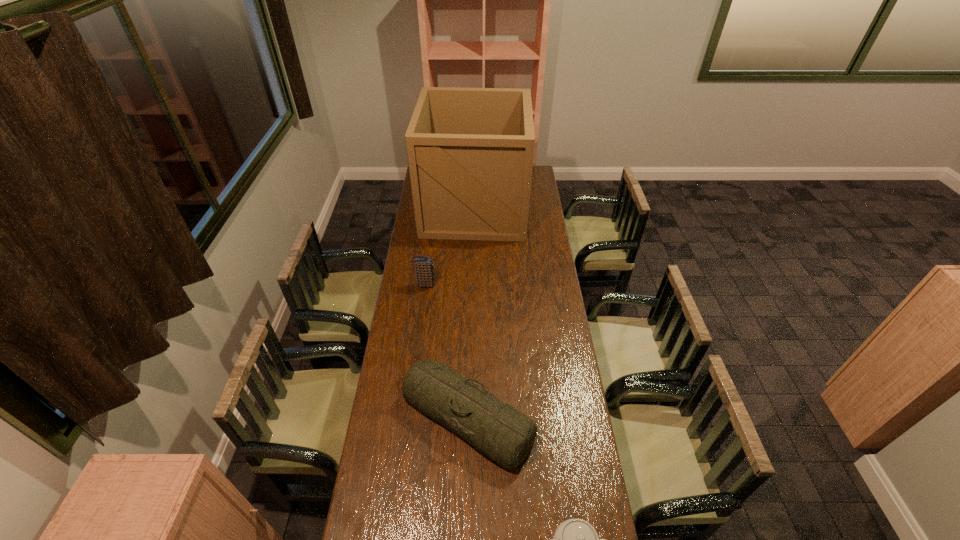
The height and width of the screenshot is (540, 960). What are the coordinates of `duffel bag positioned at the left edge` in the screenshot? It's located at (498, 430).

This screenshot has height=540, width=960. Find the location of `object at the right edge`. object at the right edge is located at coordinates (470, 151).

I want to click on object located at the far left corner, so click(470, 151).

Find the location of a particular element. This screenshot has height=540, width=960. object situated at the far right corner is located at coordinates (470, 151).

Find the location of a particular element. The height and width of the screenshot is (540, 960). vacant space at the left edge is located at coordinates (408, 494).

This screenshot has height=540, width=960. In order to click on vacant space at the right edge in this screenshot , I will do `click(540, 430)`.

This screenshot has height=540, width=960. In order to click on free spot between the tallest object and the clutch bag in this screenshot , I will do `click(449, 246)`.

Where is `empty space between the second nearest object and the clutch bag`? The image size is (960, 540). empty space between the second nearest object and the clutch bag is located at coordinates (446, 351).

This screenshot has height=540, width=960. I want to click on free point between the third farthest object and the clutch bag, so click(x=446, y=351).

Select which object appears as the third closest to the box. Please provide its 2D coordinates. Your answer should be formatted as a tuple, i.e. [(x, y)], where the tuple contains the x and y coordinates of a point satisfying the conditions above.

[(574, 539)]